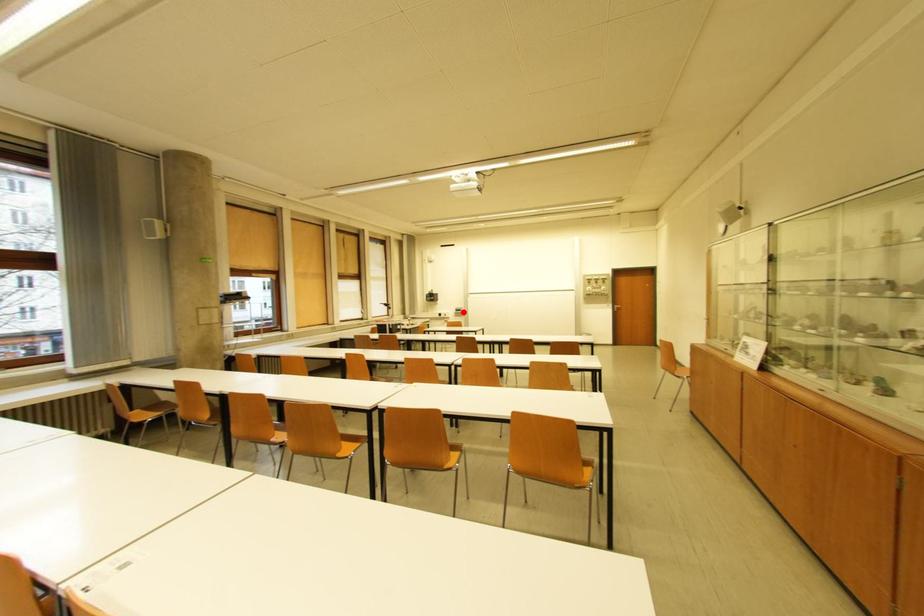
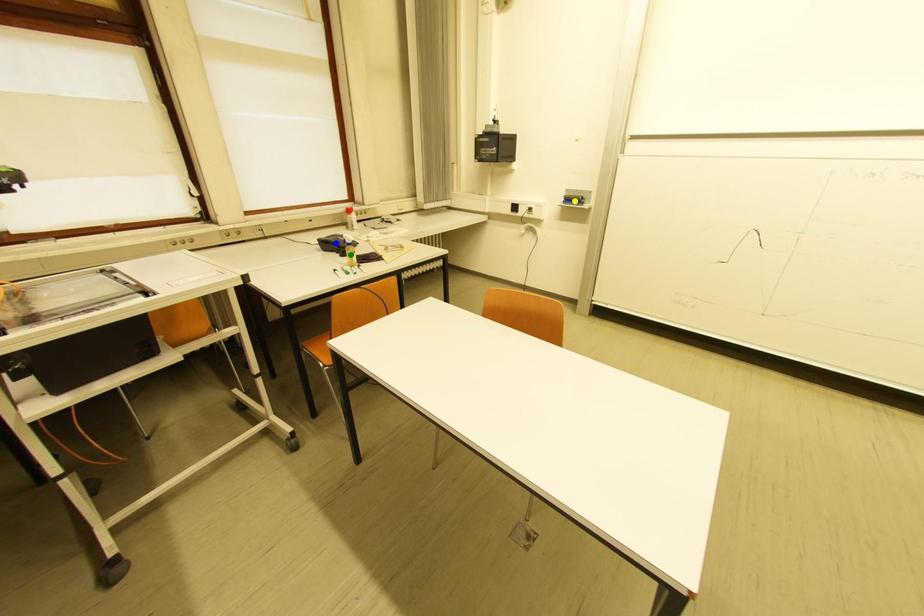
Question: I am providing you with two images of the same scene from different viewpoints. A red point is marked on the first image. You are given multiple points on the second image. Which spot in image 2 lines up with the point in image 1?

Choices:
 (A) yellow point
 (B) green point
 (C) blue point

Answer: (A)